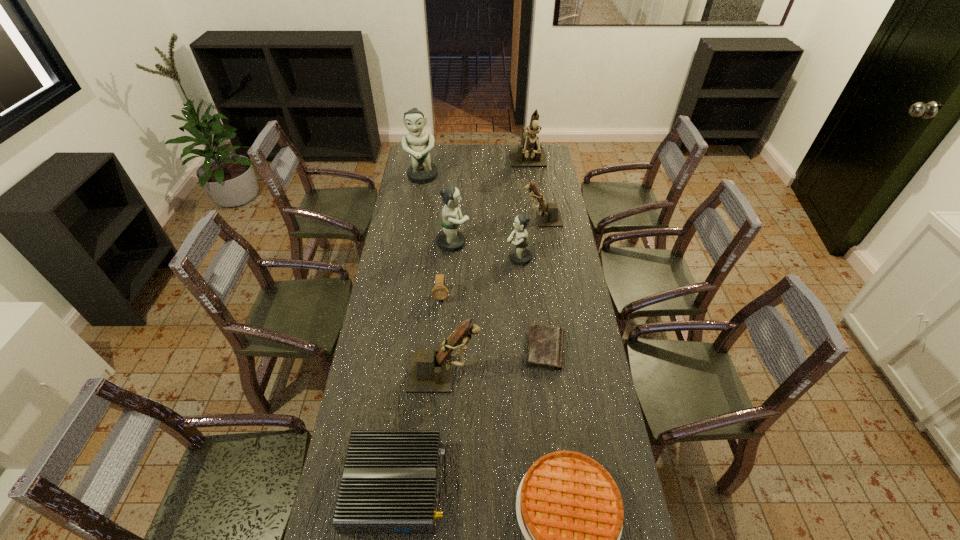
You are a GUI agent. You are given a task and a screenshot of the screen. Output one action in this format:
    pyautogui.click(x=<x>, y=<y>)
    Task: Click on the leftmost green figurine
    Image resolution: width=960 pixels, height=540 pixels.
    Given the screenshot: What is the action you would take?
    pyautogui.click(x=422, y=171)

Locate an element on the screen. The image size is (960, 540). the biggest green figurine is located at coordinates (422, 171).

The width and height of the screenshot is (960, 540). What are the coordinates of `the biggest brown figurine` in the screenshot? It's located at (528, 154).

Find the location of `the second biggest green figurine`. the second biggest green figurine is located at coordinates (450, 240).

This screenshot has width=960, height=540. I want to click on the nearest figurine, so click(x=430, y=371).

Where is `the nearest brown figurine`? The height and width of the screenshot is (540, 960). the nearest brown figurine is located at coordinates (430, 371).

The height and width of the screenshot is (540, 960). I want to click on the smallest brown figurine, so click(x=549, y=216).

Identify the location of the third farthest object. Image resolution: width=960 pixels, height=540 pixels. (549, 216).

Find the location of a particular element. The height and width of the screenshot is (540, 960). the rightmost green figurine is located at coordinates (520, 255).

Find the location of a particular element. the seventh tallest object is located at coordinates (439, 292).